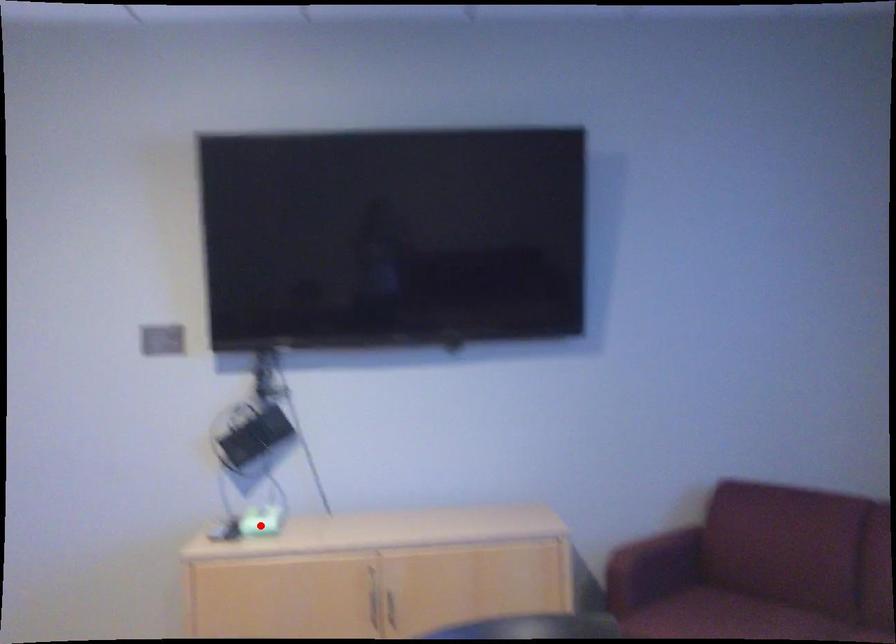
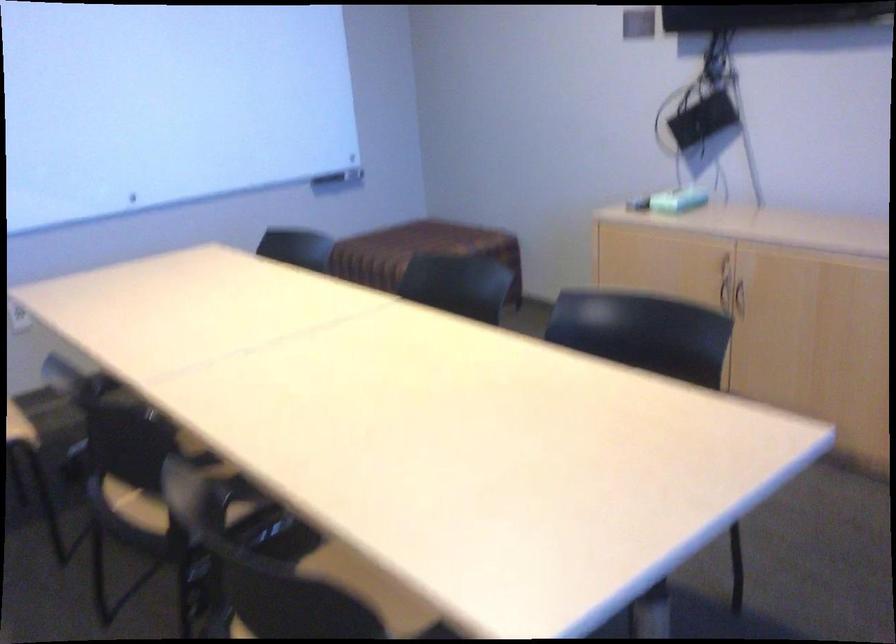
Where in the second image is the point corresponding to the highlighted location from the first image?

(677, 200)